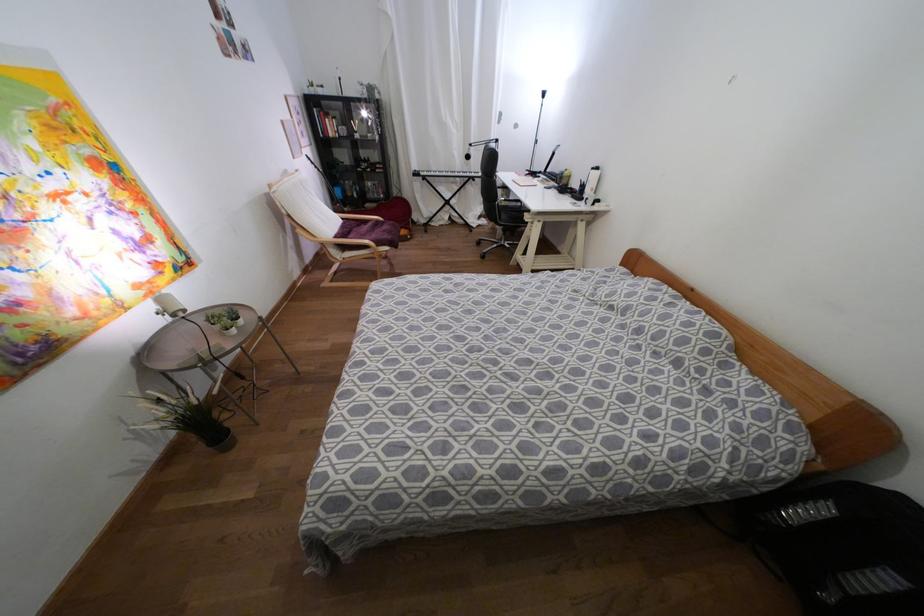
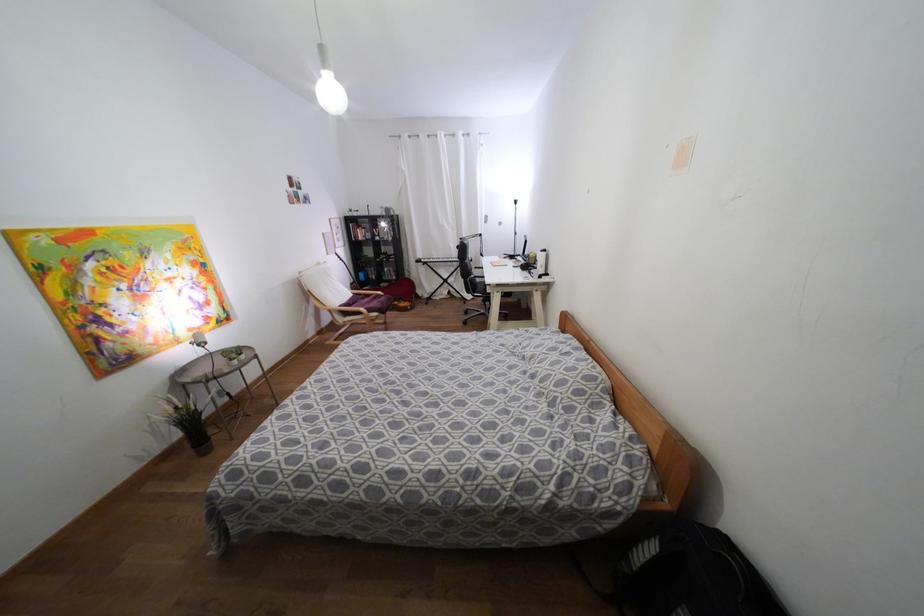
Where in the second image is the point corresponding to point (140, 292) from the first image?

(190, 333)